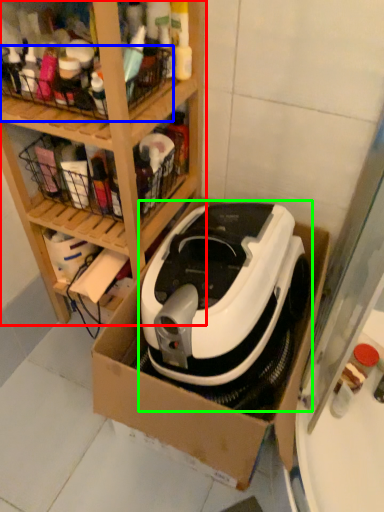
Question: Based on their relative distances, which object is farther from shelf (highlighted by a red box)? Choose from basket (highlighted by a blue box) and home appliance (highlighted by a green box).

Choices:
 (A) basket
 (B) home appliance

Answer: (B)